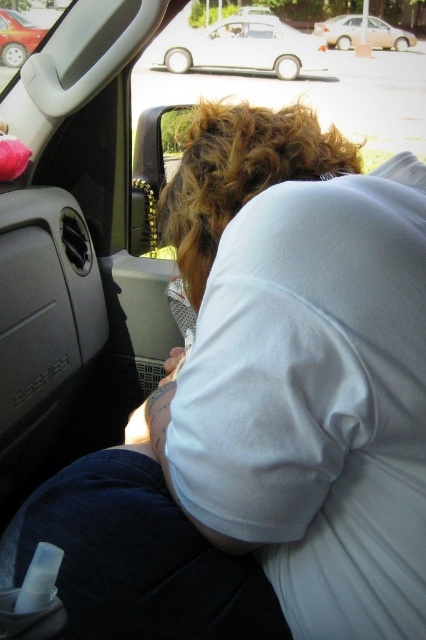
Question: Is beige matte sedan at upper center further to camera compared to metallic red car at upper left?

Choices:
 (A) yes
 (B) no

Answer: (A)

Question: Which point is closer to the camera taking this photo?

Choices:
 (A) (322, 29)
 (B) (169, 36)
 (C) (23, 52)

Answer: (C)

Question: Which of the following is the closest to the observer?

Choices:
 (A) beige matte sedan at upper center
 (B) metallic red car at upper left

Answer: (B)

Question: From the image, what is the correct spatial relationship of white matte car at upper center in relation to beige matte sedan at upper center?

Choices:
 (A) left
 (B) right

Answer: (A)

Question: Among these points, which one is farthest from the camera?

Choices:
 (A) (356, 38)
 (B) (204, 33)
 (C) (3, 36)

Answer: (A)

Question: Is white matte car at upper center wider than beige matte sedan at upper center?

Choices:
 (A) yes
 (B) no

Answer: (A)